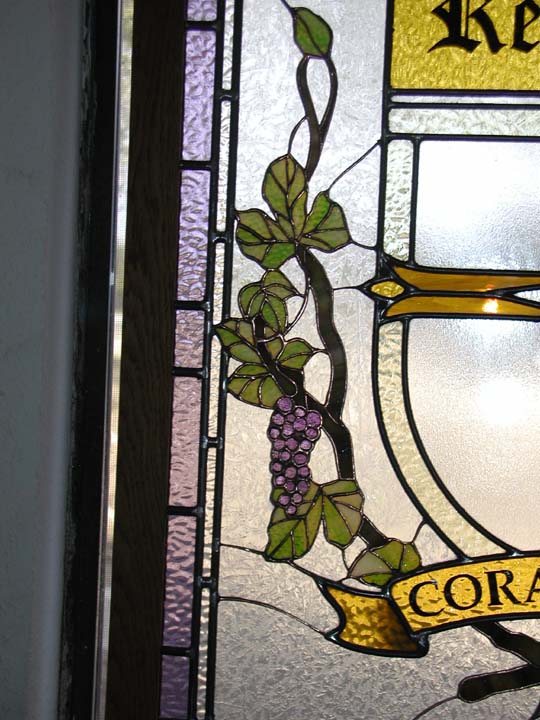
The height and width of the screenshot is (720, 540). I want to click on inner glass sections, so click(230, 49), click(224, 132), click(218, 289), click(208, 498), click(204, 616).